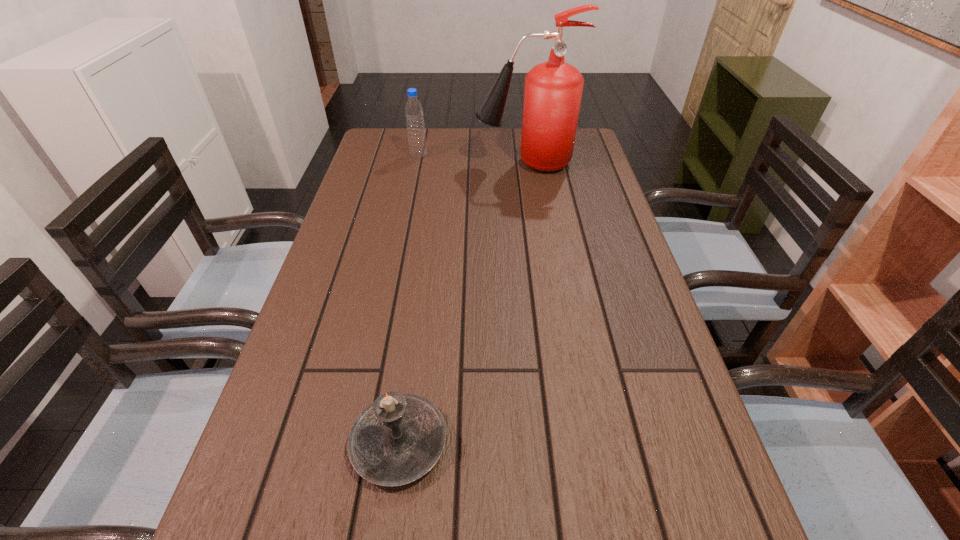
Where is `blank region between the second shortest object and the nearest object`? The image size is (960, 540). blank region between the second shortest object and the nearest object is located at coordinates (409, 299).

The height and width of the screenshot is (540, 960). Find the location of `free area in between the second tallest object and the rightmost object`. free area in between the second tallest object and the rightmost object is located at coordinates (471, 159).

This screenshot has height=540, width=960. Find the location of `free area in between the nearest object and the rightmost object`. free area in between the nearest object and the rightmost object is located at coordinates (462, 303).

Identify which object is the second closest to the second shortest object. Please provide its 2D coordinates. Your answer should be formatted as a tuple, i.e. [(x, y)], where the tuple contains the x and y coordinates of a point satisfying the conditions above.

[(397, 439)]

Choose which object is the nearest neighbor to the nearest object. Please provide its 2D coordinates. Your answer should be formatted as a tuple, i.e. [(x, y)], where the tuple contains the x and y coordinates of a point satisfying the conditions above.

[(553, 89)]

Find the location of a particular element. This screenshot has width=960, height=540. free space that satisfies the following two spatial constraints: 1. on the front side of the second shortest object; 2. on the right side of the candle is located at coordinates (361, 443).

Where is `vacant space that satisfies the following two spatial constraints: 1. with the nozzle aimed from the tallest object; 2. on the front side of the nearest object`? vacant space that satisfies the following two spatial constraints: 1. with the nozzle aimed from the tallest object; 2. on the front side of the nearest object is located at coordinates (564, 443).